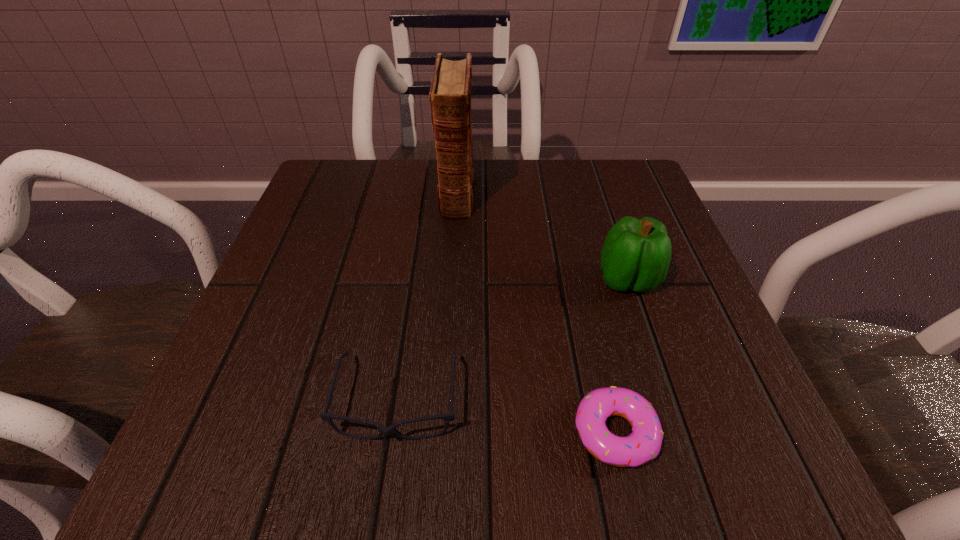
This screenshot has height=540, width=960. In the image, there is a desktop. What are the coordinates of `vacant space at the near left corner` in the screenshot? It's located at (274, 465).

Find the location of `free spot at the far right corner of the desktop`. free spot at the far right corner of the desktop is located at coordinates (662, 218).

You are a GUI agent. You are given a task and a screenshot of the screen. Output one action in this format:
    pyautogui.click(x=<x>, y=<y>)
    Task: Click on the free spot between the doughnut and the hardback book
    This screenshot has height=540, width=960.
    Given the screenshot: What is the action you would take?
    pyautogui.click(x=536, y=312)

Identify the location of empty space between the shortest object and the bell pepper. (621, 356).

The height and width of the screenshot is (540, 960). Identify the location of empty space between the third tallest object and the tallest object. (427, 296).

The width and height of the screenshot is (960, 540). What are the coordinates of `vacant area that lies between the bell pepper and the spectacles` in the screenshot? It's located at pos(513,341).

Where is `vacant space in between the second farthest object and the third tallest object`? vacant space in between the second farthest object and the third tallest object is located at coordinates (513, 341).

Locate an element on the screen. The image size is (960, 540). free area in between the tallest object and the bell pepper is located at coordinates (542, 236).

Locate an element on the screen. The image size is (960, 540). vacant point located between the shortest object and the third nearest object is located at coordinates (621, 356).

Find the location of a particular element. This screenshot has width=960, height=540. free space between the shortest object and the third nearest object is located at coordinates pos(621,356).